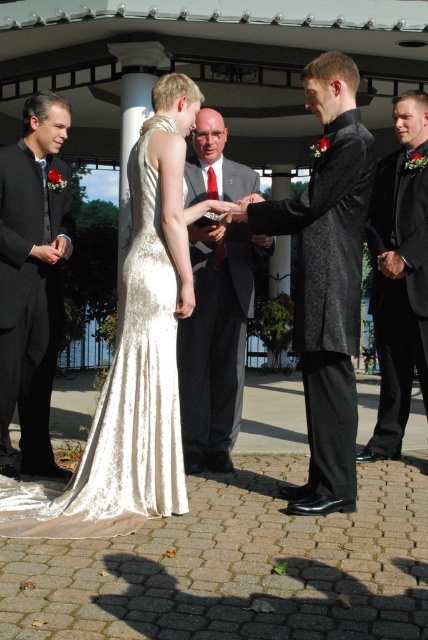
You are a photographer standing at the back of the pavilion during the wedding ceremony. You want to capture a closeup shot of the ivory satin dress at center and the matte gray suit at center. Which one should you focus on first to ensure it is in sharp focus?

The ivory satin dress at center is closer to the viewer than the matte gray suit at center, so you should focus on the ivory satin dress at center first to ensure it is in sharp focus before adjusting for the matte gray suit at center.